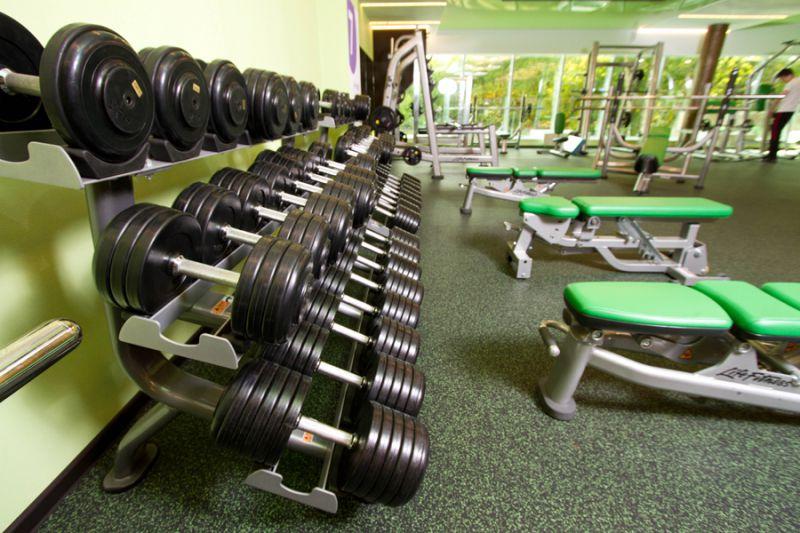
Identify the location of green cushion. The height and width of the screenshot is (533, 800). (660, 300), (737, 302), (778, 294), (654, 197), (554, 211), (561, 168), (526, 177), (494, 177).